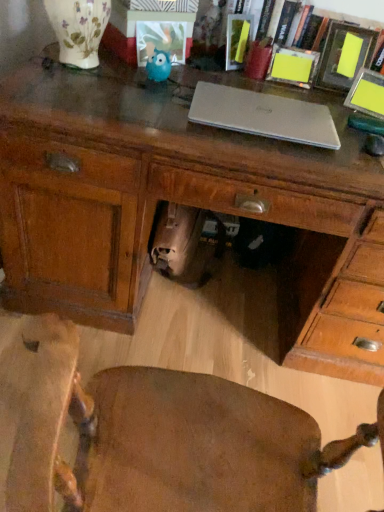
Question: Is matte wooden picture frame at upper right, which is counted as the third picture frame, starting from the left, touching yellow paper picture frame at upper right, which ranks as the 1th picture frame in right-to-left order?

Choices:
 (A) yes
 (B) no

Answer: (B)

Question: From a real-world perspective, does matte wooden picture frame at upper right, which is the second picture frame in right-to-left order, stand above yellow paper picture frame at upper right, which ranks as the 4th picture frame in left-to-right order?

Choices:
 (A) yes
 (B) no

Answer: (A)

Question: Is matte wooden picture frame at upper right, which is the second picture frame in right-to-left order, in front of yellow paper picture frame at upper right, which ranks as the 1th picture frame in right-to-left order?

Choices:
 (A) yes
 (B) no

Answer: (B)

Question: Is matte wooden picture frame at upper right, which is the second picture frame in right-to-left order, completely or partially outside of yellow paper picture frame at upper right, which ranks as the 1th picture frame in right-to-left order?

Choices:
 (A) no
 (B) yes

Answer: (B)

Question: Is matte wooden picture frame at upper right, which is the second picture frame in right-to-left order, facing towards yellow paper picture frame at upper right, which ranks as the 4th picture frame in left-to-right order?

Choices:
 (A) yes
 (B) no

Answer: (A)

Question: Is yellow paper picture frame at upper right, which ranks as the 1th picture frame in right-to-left order, located within matte wooden picture frame at upper right, which is counted as the third picture frame, starting from the left?

Choices:
 (A) no
 (B) yes

Answer: (A)

Question: Is wooden desk at center a part of matte plastic picture frame at center, the first picture frame positioned from the left?

Choices:
 (A) no
 (B) yes

Answer: (A)

Question: From the image's perspective, is matte plastic picture frame at center, marked as the fourth picture frame in a right-to-left arrangement, on top of wooden desk at center?

Choices:
 (A) no
 (B) yes

Answer: (B)

Question: Can you confirm if matte plastic picture frame at center, the first picture frame positioned from the left, is shorter than wooden desk at center?

Choices:
 (A) yes
 (B) no

Answer: (A)

Question: Can we say matte plastic picture frame at center, the first picture frame positioned from the left, lies outside wooden desk at center?

Choices:
 (A) no
 (B) yes

Answer: (B)

Question: From a real-world perspective, is matte plastic picture frame at center, the first picture frame positioned from the left, below wooden desk at center?

Choices:
 (A) no
 (B) yes

Answer: (A)

Question: From the image's perspective, is matte plastic picture frame at center, marked as the fourth picture frame in a right-to-left arrangement, below wooden desk at center?

Choices:
 (A) no
 (B) yes

Answer: (A)

Question: Can you confirm if blue fuzzy owl at center is positioned to the left of wooden chair at center?

Choices:
 (A) yes
 (B) no

Answer: (A)